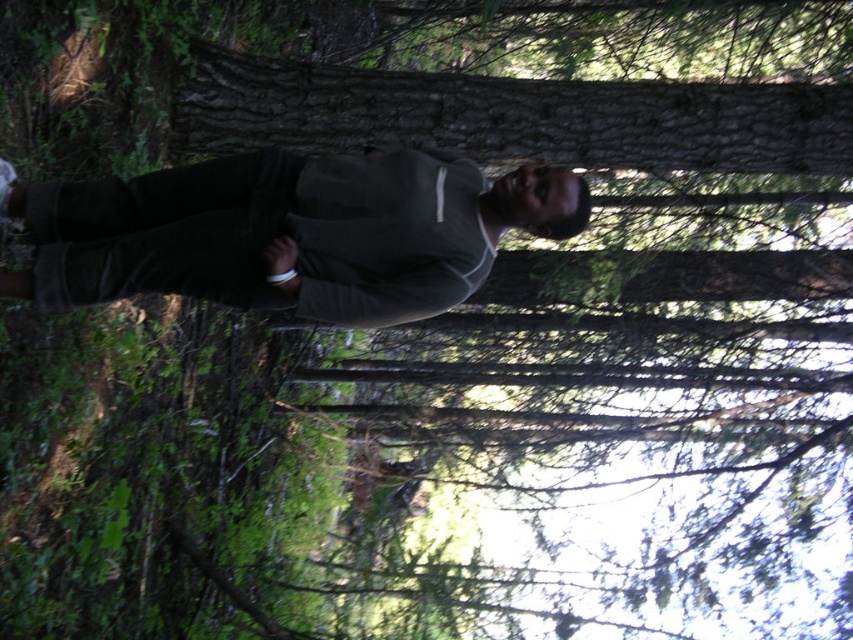
Who is shorter, gray matte sweater at center or smooth brown bark at center?

gray matte sweater at center is shorter.

Does gray matte sweater at center have a larger size compared to smooth brown bark at center?

No, gray matte sweater at center is not bigger than smooth brown bark at center.

The height and width of the screenshot is (640, 853). What do you see at coordinates (289, 232) in the screenshot?
I see `gray matte sweater at center` at bounding box center [289, 232].

Locate an element on the screen. gray matte sweater at center is located at coordinates (289, 232).